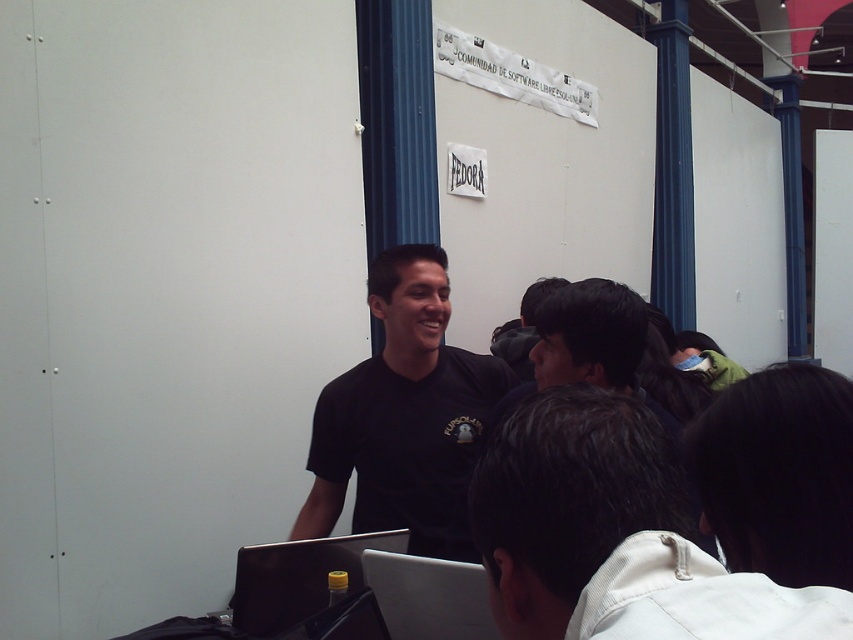
Is white corduroy jacket at lower right bigger than silver metallic laptop at center?

Correct, white corduroy jacket at lower right is larger in size than silver metallic laptop at center.

Between white corduroy jacket at lower right and silver metallic laptop at center, which one has more height?

white corduroy jacket at lower right

Between point (554, 445) and point (469, 577), which one is positioned in front?

Point (554, 445)

I want to click on white corduroy jacket at lower right, so click(x=614, y=536).

Can you confirm if black matte shirt at center is positioned above black hair at lower right?

No.

At what (x,y) coordinates should I click in order to perform the action: click on black matte shirt at center. Please return your answer as a coordinate pair (x, y). This screenshot has width=853, height=640. Looking at the image, I should click on (403, 417).

Which is in front, point (456, 452) or point (727, 403)?

Point (727, 403) is more forward.

This screenshot has height=640, width=853. Identify the location of black matte shirt at center. click(403, 417).

Is black matte shirt at center below silver metallic laptop at center?

No.

Is point (440, 380) more distant than point (465, 621)?

Yes, point (440, 380) is farther from viewer.

Between point (468, 422) and point (469, 604), which one is positioned behind?

The point (468, 422) is behind.

Image resolution: width=853 pixels, height=640 pixels. What are the coordinates of `black matte shirt at center` in the screenshot? It's located at (403, 417).